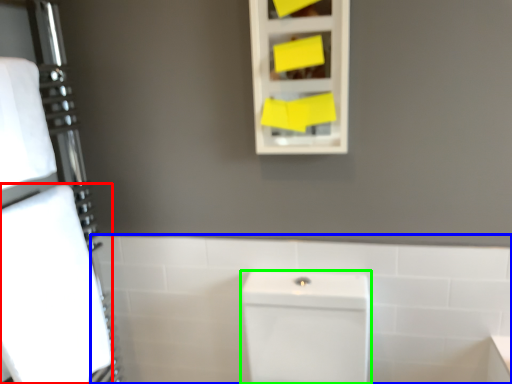
Question: Estimate the real-world distances between objects in this image. Which object is farther from bath towel (highlighted by a red box), bath (highlighted by a blue box) or porcelain (highlighted by a green box)?

Choices:
 (A) bath
 (B) porcelain

Answer: (B)